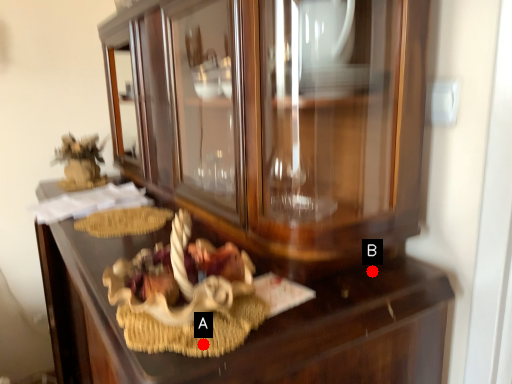
Question: Two points are circled on the image, labeled by A and B beside each circle. Which point is closer to the camera taking this photo?

Choices:
 (A) A is closer
 (B) B is closer

Answer: (A)